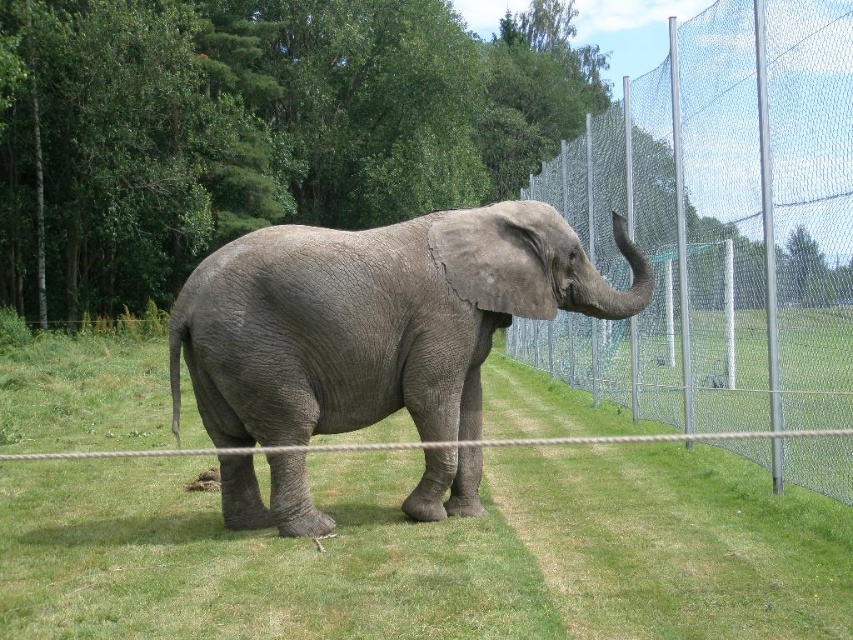
Who is taller, green grassy at center or metal mesh fence at right?

metal mesh fence at right

At what (x,y) coordinates should I click in order to perform the action: click on green grassy at center. Please return your answer as a coordinate pair (x, y). This screenshot has width=853, height=640. Looking at the image, I should click on (428, 552).

The image size is (853, 640). What are the coordinates of `green grassy at center` in the screenshot? It's located at (428, 552).

Between point (218, 589) and point (578, 285), which one is positioned behind?

The point (578, 285) is behind.

Which is below, green grassy at center or gray textured elephant at center?

Positioned lower is green grassy at center.

Does point (751, 616) lie in front of point (421, 346)?

Yes, it is in front of point (421, 346).

The width and height of the screenshot is (853, 640). In order to click on green grassy at center in this screenshot , I will do `click(428, 552)`.

Is metal mesh fence at right smaller than gray textured elephant at center?

No, metal mesh fence at right is not smaller than gray textured elephant at center.

Which is below, metal mesh fence at right or gray textured elephant at center?

gray textured elephant at center is below.

Is point (786, 67) positioned before point (488, 323)?

Yes.

Where is `metal mesh fence at right`? The image size is (853, 640). metal mesh fence at right is located at coordinates 720,225.